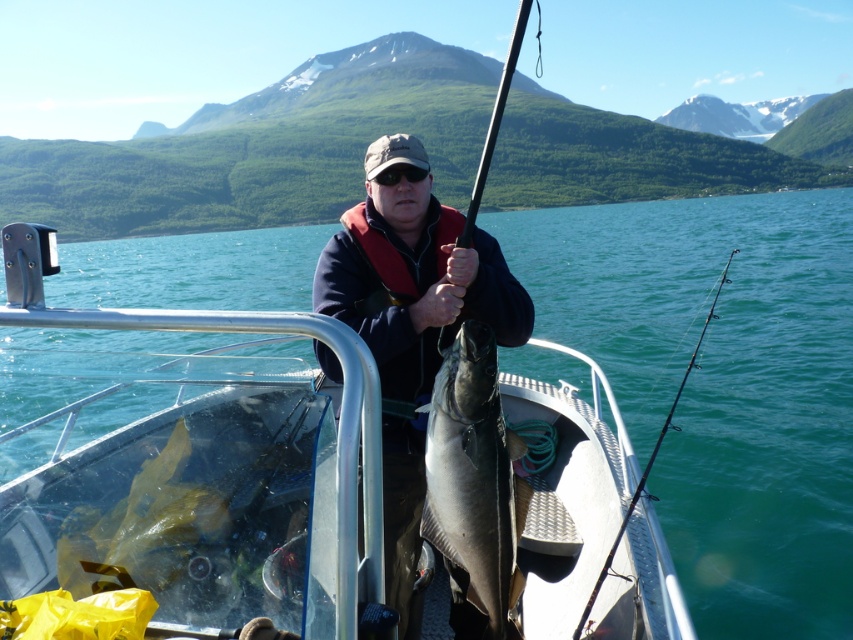
Question: Based on their relative distances, which object is nearer to the teal glossy water at center?

Choices:
 (A) matte black jacket at center
 (B) shiny silver fish at center

Answer: (B)

Question: Does matte black jacket at center have a smaller size compared to shiny silver fish at center?

Choices:
 (A) no
 (B) yes

Answer: (A)

Question: Considering the real-world distances, which object is farthest from the shiny silver fish at center?

Choices:
 (A) teal glossy water at center
 (B) matte black jacket at center
 (C) black rod at right

Answer: (A)

Question: Does matte black jacket at center have a smaller size compared to shiny silver fish at center?

Choices:
 (A) no
 (B) yes

Answer: (A)

Question: Which object appears farthest from the camera in this image?

Choices:
 (A) smooth black rod at center
 (B) shiny silver fish at center
 (C) black rod at right
 (D) matte black jacket at center

Answer: (C)

Question: Can you confirm if teal glossy water at center is thinner than matte black jacket at center?

Choices:
 (A) yes
 (B) no

Answer: (B)